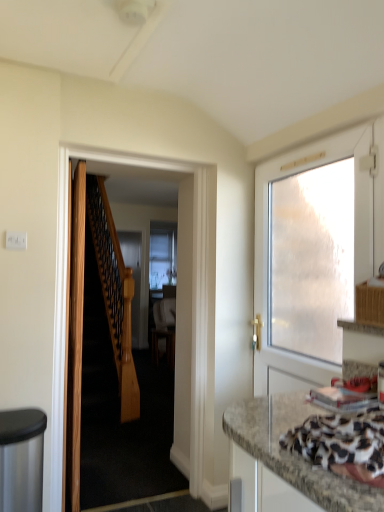
Question: Visually, is wooden door at left, positioned as the 3th door in right-to-left order, positioned to the left or to the right of wooden door at center, the second door when ordered from left to right?

Choices:
 (A) right
 (B) left

Answer: (B)

Question: Looking at their shapes, would you say wooden door at left, positioned as the 3th door in right-to-left order, is wider or thinner than wooden door at center, the second door when ordered from left to right?

Choices:
 (A) wide
 (B) thin

Answer: (A)

Question: Which is nearer to the wooden door at left, which ranks as the first door in left-to-right order?

Choices:
 (A) granite-patterned countertop at lower right
 (B) white frosted glass door at right, which ranks as the 1th door in right-to-left order
 (C) wooden door at center, which ranks as the second door in right-to-left order

Answer: (C)

Question: Based on their relative distances, which object is nearer to the granite-patterned countertop at lower right?

Choices:
 (A) white frosted glass door at right, which ranks as the 1th door in right-to-left order
 (B) wooden door at left, positioned as the 3th door in right-to-left order
 (C) wooden door at center, which ranks as the second door in right-to-left order

Answer: (A)